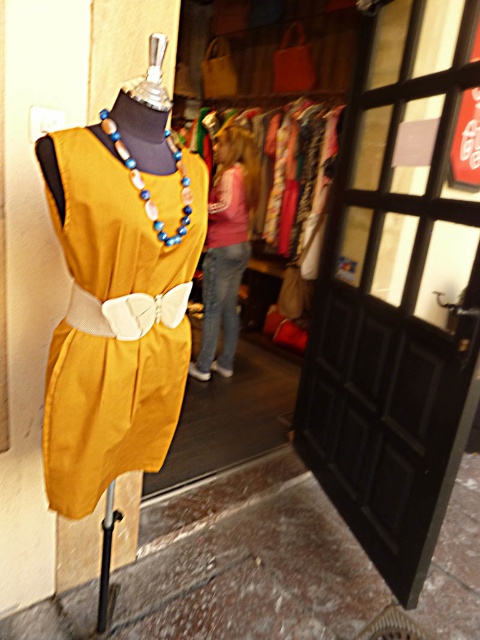
You are standing at the entrance of the clothing store and want to exit through the black wooden door at right. According to the coordinates provided, is the point marked as point (398,289) located on the door?

Yes, the point (398,289) marks the black wooden door at right, so it is located on the door.

You are standing in front of the clothing store and want to enter. Where is the black wooden door at right located?

The black wooden door at right is located at point (398, 289).